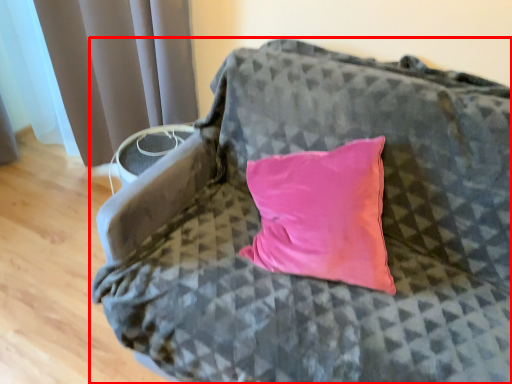
Question: From the image's perspective, where is furniture (annotated by the red box) located in relation to curtain in the image?

Choices:
 (A) above
 (B) below

Answer: (B)